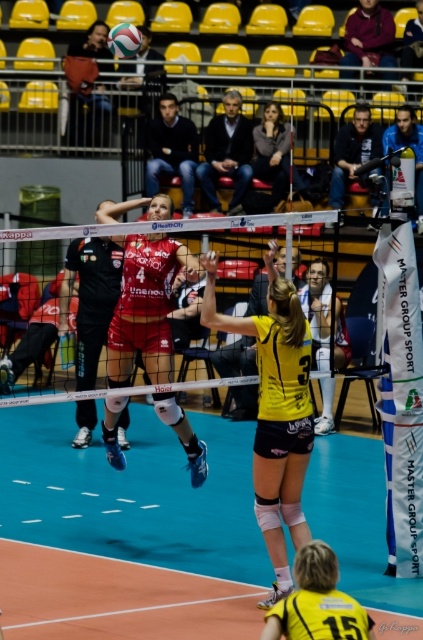
Which is above, dark gray fabric jacket at upper center or yellow matte volleyball at upper center?

yellow matte volleyball at upper center

Is point (266, 166) behind point (131, 26)?

Yes, point (266, 166) is farther from viewer.

Between point (286, 145) and point (121, 40), which one is positioned in front?

Point (121, 40) is in front.

You are a GUI agent. You are given a task and a screenshot of the screen. Output one action in this format:
    pyautogui.click(x=<x>, y=<y>)
    Task: Click on the dark gray fabric jacket at upper center
    
    Given the screenshot: What is the action you would take?
    pyautogui.click(x=272, y=150)

Is white mesh net at center to the right of dark gray fabric jacket at upper center from the viewer's perspective?

No, white mesh net at center is not to the right of dark gray fabric jacket at upper center.

Does white mesh net at center have a larger size compared to dark gray fabric jacket at upper center?

No.

Does point (47, 234) come closer to viewer compared to point (280, 113)?

Yes, point (47, 234) is closer to viewer.

This screenshot has width=423, height=640. Identify the location of white mesh net at center. tap(125, 392).

Does yellow jersey at center have a larger size compared to dark gray fabric jacket at upper center?

Yes, yellow jersey at center is bigger than dark gray fabric jacket at upper center.

Measure the distance between point [288,593] and camera.

Point [288,593] is 8.13 meters away from camera.

In order to click on yellow jersey at center in this screenshot , I will do pyautogui.click(x=275, y=412).